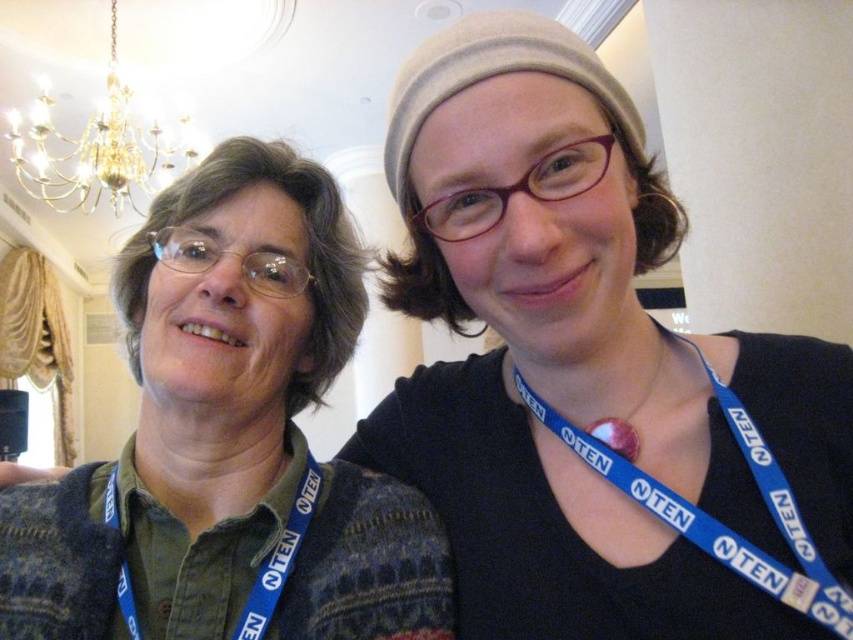
Question: Which of these objects is positioned farthest from the skinsmoothneck at center?

Choices:
 (A) matte blue lanyard at center
 (B) gold metallic chandelier at upper left

Answer: (B)

Question: Observing the image, what is the correct spatial positioning of skinsmoothneck at center in reference to matte blue lanyard at center?

Choices:
 (A) below
 (B) above

Answer: (A)

Question: Among these objects, which one is farthest from the camera?

Choices:
 (A) matte red medal at center
 (B) gold metallic chandelier at upper left
 (C) matte blue lanyard at center

Answer: (B)

Question: Which point appears closest to the camera in this image?

Choices:
 (A) (630, 406)
 (B) (267, 404)
 (C) (57, 164)

Answer: (A)

Question: Is the position of blue fabric lanyard at upper right more distant than that of matte red medal at center?

Choices:
 (A) yes
 (B) no

Answer: (B)

Question: Observing the image, what is the correct spatial positioning of green fabric shirt at left in reference to blue fabric lanyard at left?

Choices:
 (A) above
 (B) below

Answer: (A)